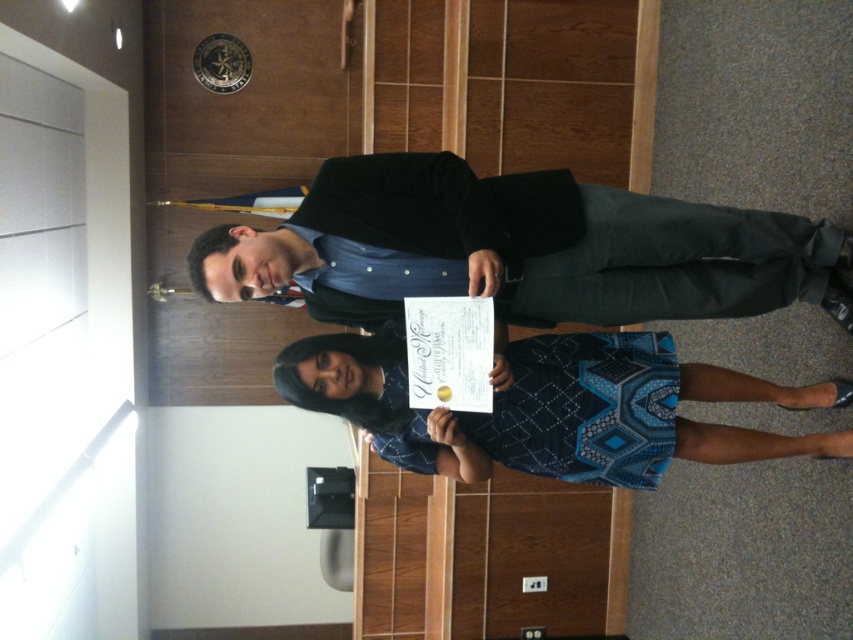
You are a photographer preparing to take a group photo of the two individuals in the scene. You need to ensure that both the black smooth suit at center and the blue printed fabric dress at center are clearly visible in the frame. Given their height difference, which clothing item should be placed closer to the camera to maintain visibility?

The blue printed fabric dress at center should be placed closer to the camera because the black smooth suit at center is much taller, so positioning the shorter blue printed fabric dress at center nearer will help ensure both are visible in the photo.

Please describe the position of the black smooth suit at center in terms of coordinates within the image frame. The image frame has its origin at the bottom left corner, with x increasing to the right and y increasing upwards. Use the format x,y for the coordinates.

The black smooth suit at center is located at coordinates [544,244] within the image frame.